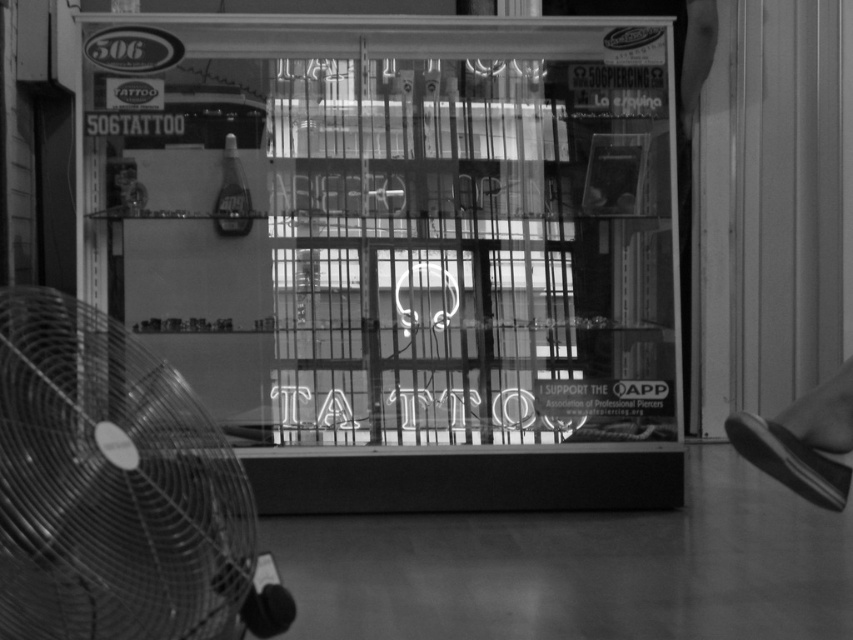
Question: Which of the following is the farthest from the observer?

Choices:
 (A) neon sign tattoo at center
 (B) metallic fan at left

Answer: (A)

Question: Which point is farther to the camera?

Choices:
 (A) (195, 608)
 (B) (386, 353)

Answer: (B)

Question: Does neon sign tattoo at center have a lesser width compared to metallic fan at left?

Choices:
 (A) no
 (B) yes

Answer: (A)

Question: Among these points, which one is farthest from the camera?

Choices:
 (A) click(x=283, y=355)
 (B) click(x=115, y=624)

Answer: (A)

Question: Does neon sign tattoo at center lie behind metallic fan at left?

Choices:
 (A) yes
 (B) no

Answer: (A)

Question: Is neon sign tattoo at center smaller than metallic fan at left?

Choices:
 (A) yes
 (B) no

Answer: (B)